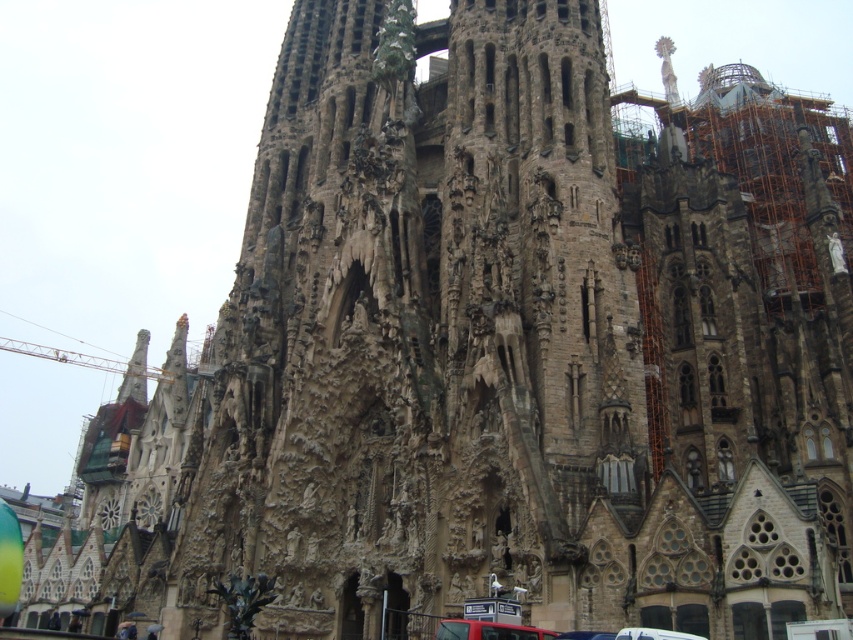
Question: Which object is farther from the camera taking this photo?

Choices:
 (A) white plastic car at lower center
 (B) matte red car at lower center

Answer: (B)

Question: Among these objects, which one is farthest from the camera?

Choices:
 (A) matte red car at lower center
 (B) white plastic car at lower center

Answer: (A)

Question: Does matte red car at lower center appear under white plastic car at lower center?

Choices:
 (A) yes
 (B) no

Answer: (A)

Question: Is matte red car at lower center to the right of white plastic car at lower center from the viewer's perspective?

Choices:
 (A) no
 (B) yes

Answer: (A)

Question: Does matte red car at lower center have a greater width compared to white plastic car at lower center?

Choices:
 (A) yes
 (B) no

Answer: (A)